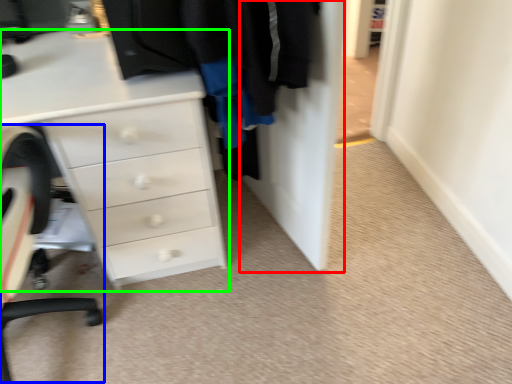
Question: Which is farther away from door (highlighted by a red box)? computer chair (highlighted by a blue box) or chest of drawers (highlighted by a green box)?

Choices:
 (A) computer chair
 (B) chest of drawers

Answer: (A)